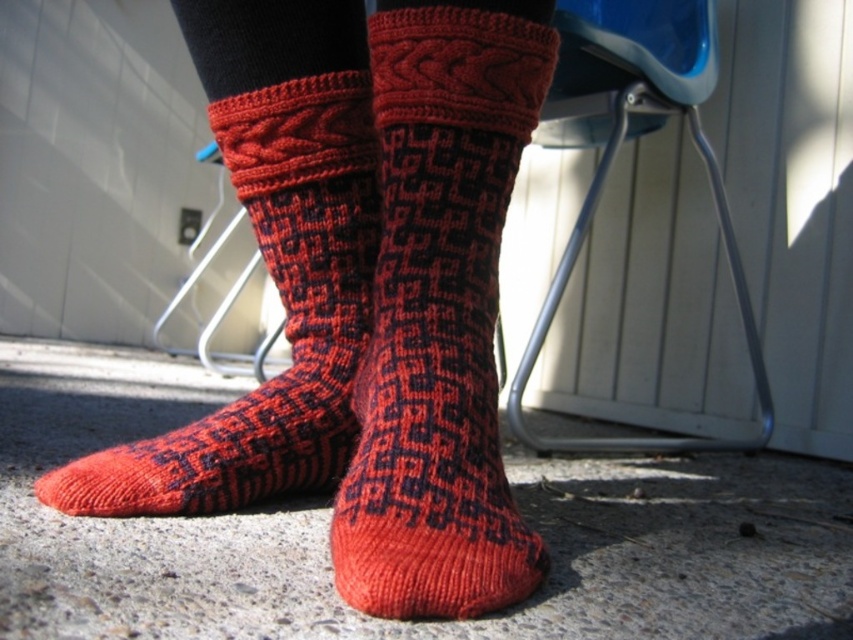
Is knitted woolen sock at center further to the viewer compared to blue plastic chair at center?

No, knitted woolen sock at center is closer to the viewer.

Between knitted woolen sock at center and blue plastic chair at center, which one is positioned lower?

Positioned lower is knitted woolen sock at center.

Describe the element at coordinates (270, 260) in the screenshot. I see `knitted woolen sock at center` at that location.

Find the location of a particular element. The height and width of the screenshot is (640, 853). knitted woolen sock at center is located at coordinates 270,260.

Does knitted wool socks at center appear under knitted woolen sock at center?

Yes, knitted wool socks at center is below knitted woolen sock at center.

Is knitted wool socks at center bigger than knitted woolen sock at center?

Yes.

Is point (386, 477) positioned after point (345, 372)?

No, (386, 477) is in front of (345, 372).

This screenshot has height=640, width=853. Find the location of `knitted wool socks at center`. knitted wool socks at center is located at coordinates (439, 312).

Can you confirm if knitted wool socks at center is positioned below blue plastic chair at center?

Indeed, knitted wool socks at center is positioned under blue plastic chair at center.

Which is in front, point (477, 604) or point (720, 448)?

Point (477, 604)

What are the coordinates of `knitted wool socks at center` in the screenshot? It's located at (439, 312).